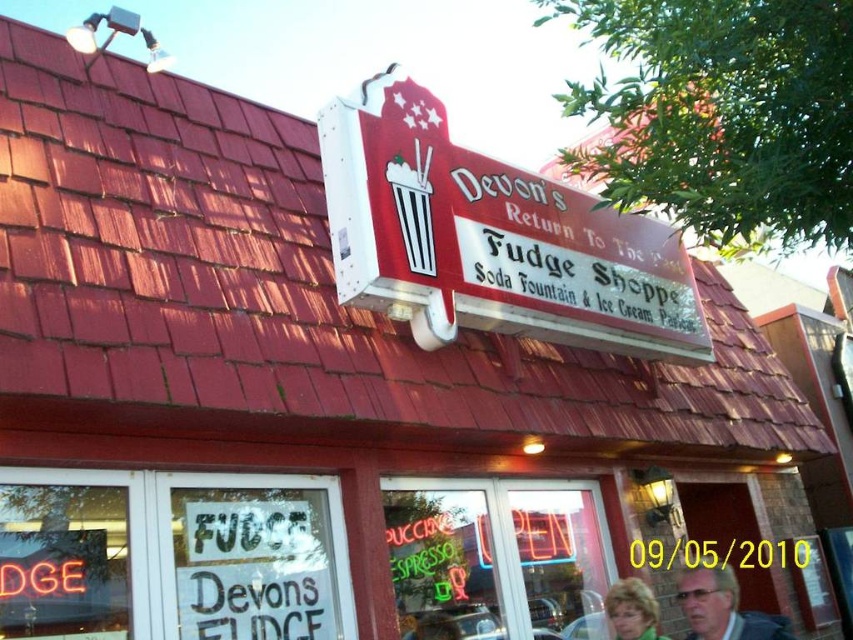
Consider the image. Does matte gray hair at center appear on the right side of blonde hair at center?

Yes, matte gray hair at center is to the right of blonde hair at center.

Which is in front, point (679, 572) or point (619, 598)?

Point (619, 598) is in front.

Who is more distant from viewer, (x=779, y=637) or (x=614, y=634)?

The point (x=614, y=634) is behind.

Locate an element on the screen. This screenshot has height=640, width=853. matte gray hair at center is located at coordinates (722, 608).

Can you confirm if matte red sign at center is shorter than blonde hair at center?

Incorrect, matte red sign at center's height does not fall short of blonde hair at center's.

Is matte red sign at center below blonde hair at center?

No.

What do you see at coordinates (490, 237) in the screenshot?
I see `matte red sign at center` at bounding box center [490, 237].

At what (x,y) coordinates should I click in order to perform the action: click on matte red sign at center. Please return your answer as a coordinate pair (x, y). Image resolution: width=853 pixels, height=640 pixels. Looking at the image, I should click on (490, 237).

Is the position of matte red sign at center more distant than that of matte gray hair at center?

Yes, it is behind matte gray hair at center.

Who is positioned more to the right, matte red sign at center or matte gray hair at center?

From the viewer's perspective, matte gray hair at center appears more on the right side.

Between point (563, 262) and point (712, 616), which one is positioned in front?

Point (712, 616) is in front.

Identify the location of matte red sign at center. The width and height of the screenshot is (853, 640). (490, 237).